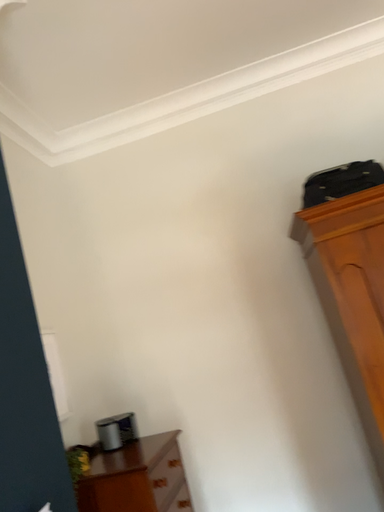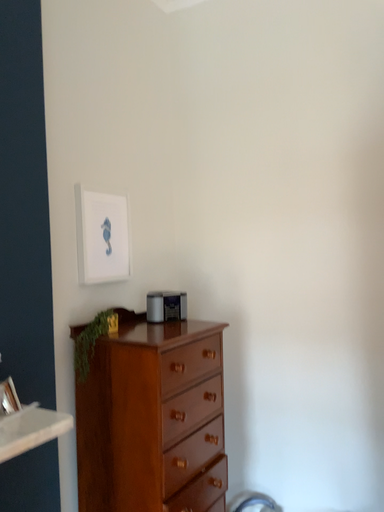
Question: Which way did the camera rotate in the video?

Choices:
 (A) rotated upward
 (B) rotated downward

Answer: (B)